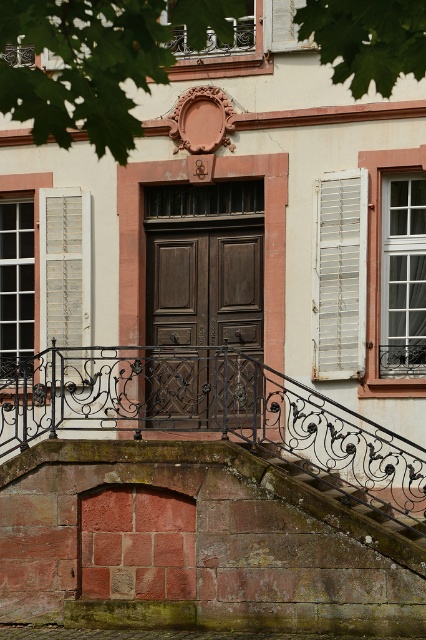
Which is behind, point (327, 374) or point (345, 529)?

The point (327, 374) is behind.

Is white painted wood shutter at right to the left of rusty metal staircase at lower center from the viewer's perspective?

Incorrect, white painted wood shutter at right is not on the left side of rusty metal staircase at lower center.

This screenshot has width=426, height=640. I want to click on white painted wood shutter at right, so click(x=339, y=275).

Does white painted wood shutter at right have a lesser width compared to white wood shutter at left?

Indeed, white painted wood shutter at right has a lesser width compared to white wood shutter at left.

How far apart are white painted wood shutter at right and white wood shutter at left?

A distance of 8.26 feet exists between white painted wood shutter at right and white wood shutter at left.

Image resolution: width=426 pixels, height=640 pixels. I want to click on white painted wood shutter at right, so click(339, 275).

Is dark brown wood door at center smaller than white painted wood shutter at right?

No.

Is dark brown wood door at center thinner than white painted wood shutter at right?

Incorrect, dark brown wood door at center's width is not less than white painted wood shutter at right's.

The image size is (426, 640). I want to click on dark brown wood door at center, so click(x=204, y=328).